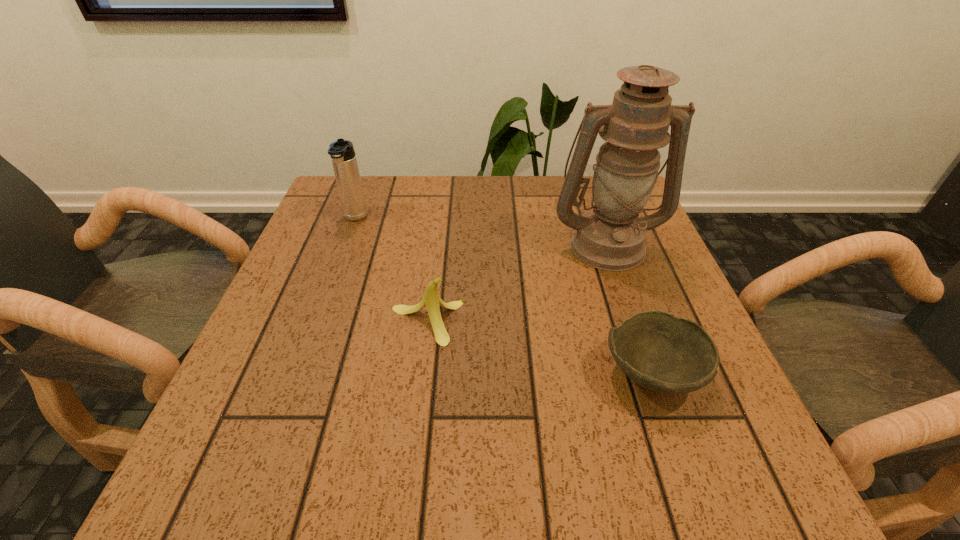
Where is `vacant position in the image that satisfies the following two spatial constraints: 1. on the handle side of the oil lamp; 2. on the right side of the second tallest object`? This screenshot has width=960, height=540. vacant position in the image that satisfies the following two spatial constraints: 1. on the handle side of the oil lamp; 2. on the right side of the second tallest object is located at coordinates (346, 245).

The height and width of the screenshot is (540, 960). Identify the location of vacant space that satisfies the following two spatial constraints: 1. on the front side of the oil lamp; 2. on the left side of the bowl. (651, 373).

Image resolution: width=960 pixels, height=540 pixels. In order to click on free space that satisfies the following two spatial constraints: 1. on the front side of the oil lamp; 2. on the right side of the shortest object in this screenshot , I will do `click(651, 373)`.